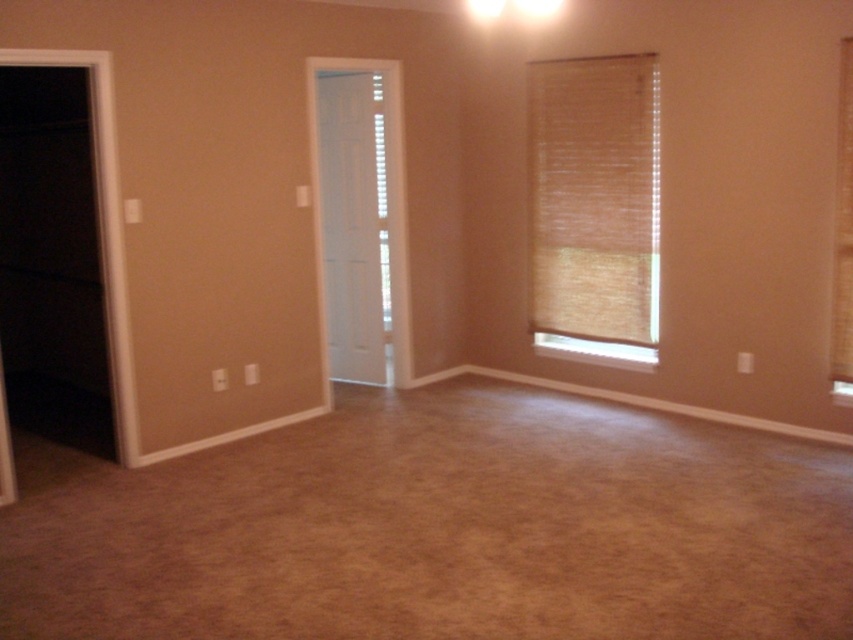
You are standing in the room and want to let more light in. Which object should you adjust to allow more light through? The bamboo blind at right or the brown textured curtain at right?

You should adjust the bamboo blind at right because it is positioned to the left of the brown textured curtain at right, meaning it is closer to the window and can be opened to let in more light.

You are standing in the room and want to let more light in. Which object, the bamboo blind at right or the brown textured curtain at right, can you adjust to allow more light into the room?

The bamboo blind at right can be adjusted to allow more light into the room since the brown textured curtain at right is behind it and cannot be easily accessed from the current position.

Looking at this image, you are a delivery person with a 1.5 meter wide package. You need to move it through the space between the bamboo blind at right and the brown textured curtain at right. Can the package fit through that space?

The distance between the bamboo blind at right and the brown textured curtain at right is 1.55 meters, so the 1.5 meter wide package can fit through the space.